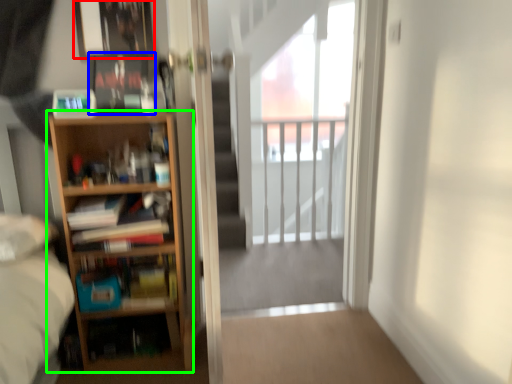
Question: Which object is positioned closest to picture frame (highlighted by a red box)? Select from book (highlighted by a blue box) and bookcase (highlighted by a green box).

Choices:
 (A) book
 (B) bookcase

Answer: (A)